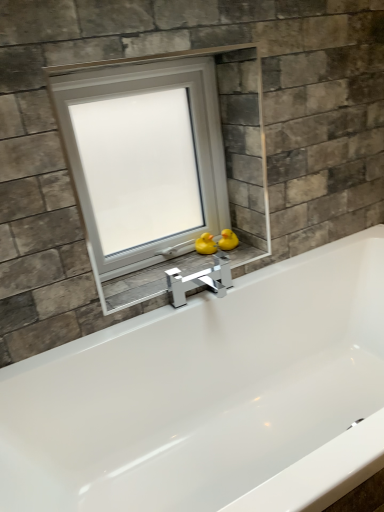
Question: Looking at the image, does yellow rubber duck at center, the first duck viewed from the right, seem bigger or smaller compared to yellow rubber duck at center, which is the 2th duck from right to left?

Choices:
 (A) big
 (B) small

Answer: (A)

Question: Considering the positions of yellow rubber duck at center, the first duck viewed from the right, and yellow rubber duck at center, acting as the 1th duck starting from the left, in the image, is yellow rubber duck at center, the first duck viewed from the right, taller or shorter than yellow rubber duck at center, acting as the 1th duck starting from the left,?

Choices:
 (A) tall
 (B) short

Answer: (B)

Question: Which object is positioned farthest from the yellow rubber duck at center, which is the 2th duck from right to left?

Choices:
 (A) yellow rubber duck at center, the first duck viewed from the right
 (B) matte gray stone at center
 (C) white plastic window at center

Answer: (C)

Question: Which object is the closest to the yellow rubber duck at center, the first duck viewed from the right?

Choices:
 (A) yellow rubber duck at center, which is the 2th duck from right to left
 (B) matte gray stone at center
 (C) white plastic window at center

Answer: (A)